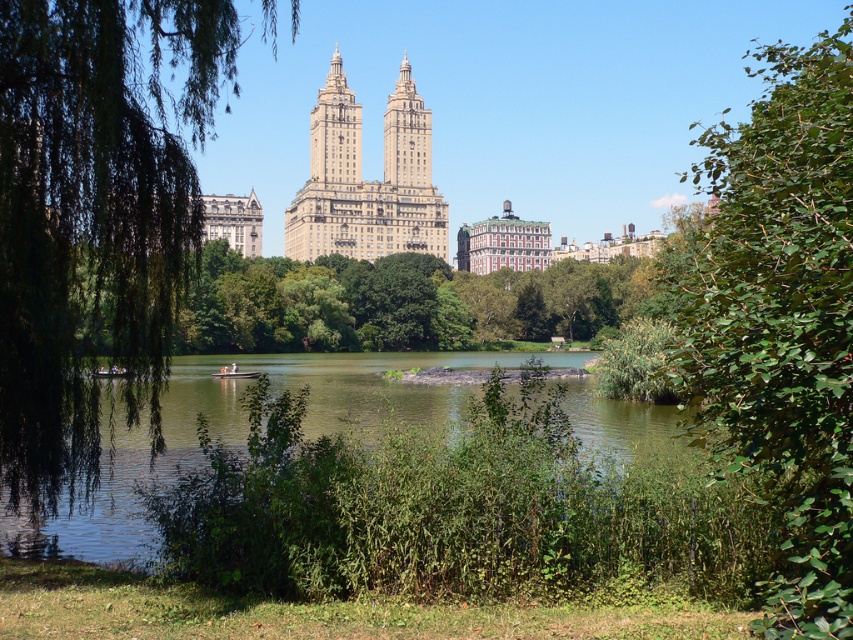
You are a park ranger planning to install a new bench between the green leafy tree at left and the green leafy tree at center. If the bench requires 2 meters of space between each tree, will there be enough space?

The distance between the green leafy tree at left and the green leafy tree at center is 33.36 meters. Subtracting the required 2 meters on each side, the remaining space is 33.36 minus 4 equals 29.36 meters, which is more than enough to place the bench between them.

You are standing in the park and want to take a photo of both the green leafy tree at left and the green leafy tree at center. Which tree should you position yourself closer to in order to capture both in the frame without zooming in?

You should position yourself closer to the green leafy tree at center because it is shorter than the green leafy tree at left, allowing both to fit within the frame when positioned appropriately.

Looking at this image, you are a park visitor standing at the entrance of the park and see the green leafy tree at left and the green leafy tree at center. Which tree is closer to the entrance?

The green leafy tree at center is closer to the entrance because it is located below the green leafy tree at left, meaning it is positioned lower in the scene and therefore nearer to the viewer.